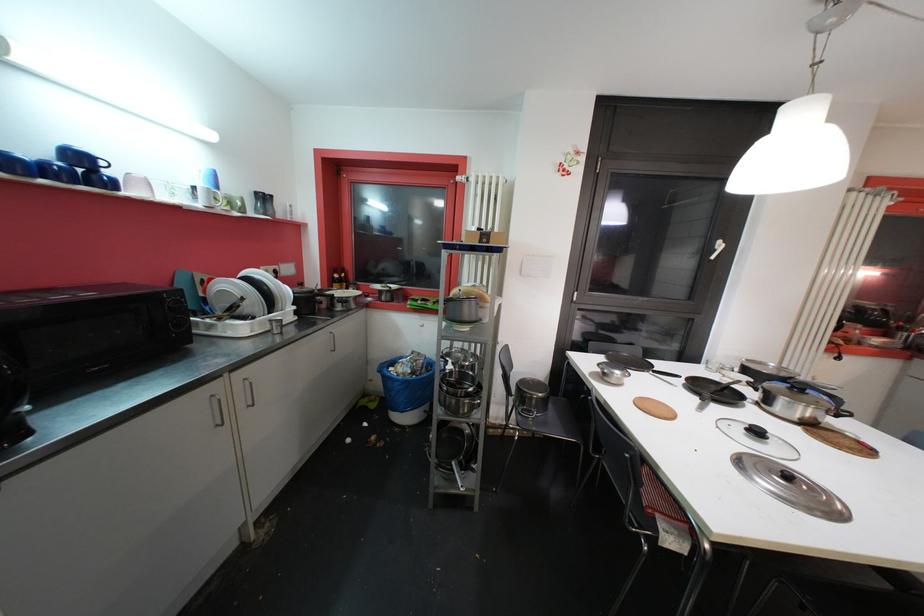
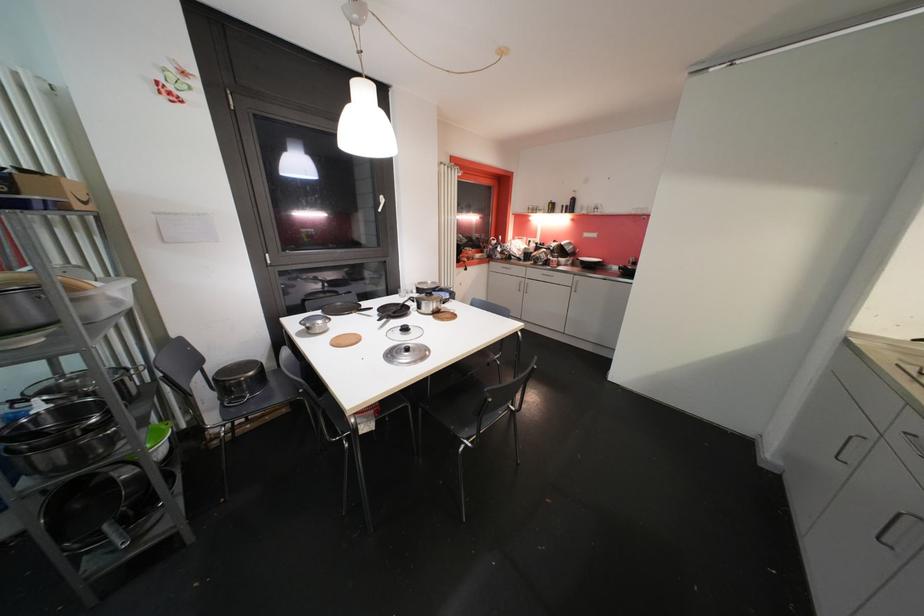
Find the pixel in the second image that matches (x=761, y=435) in the first image.

(409, 331)